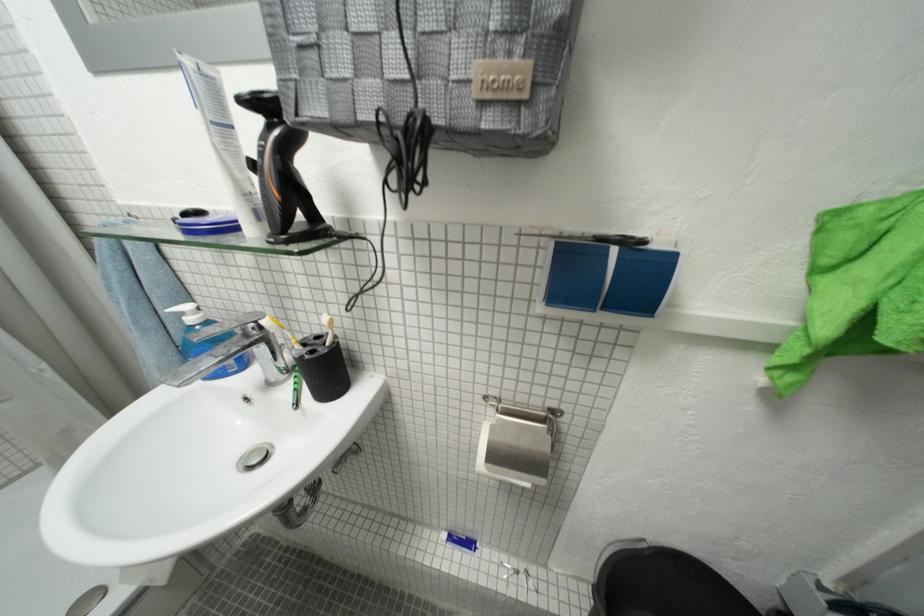
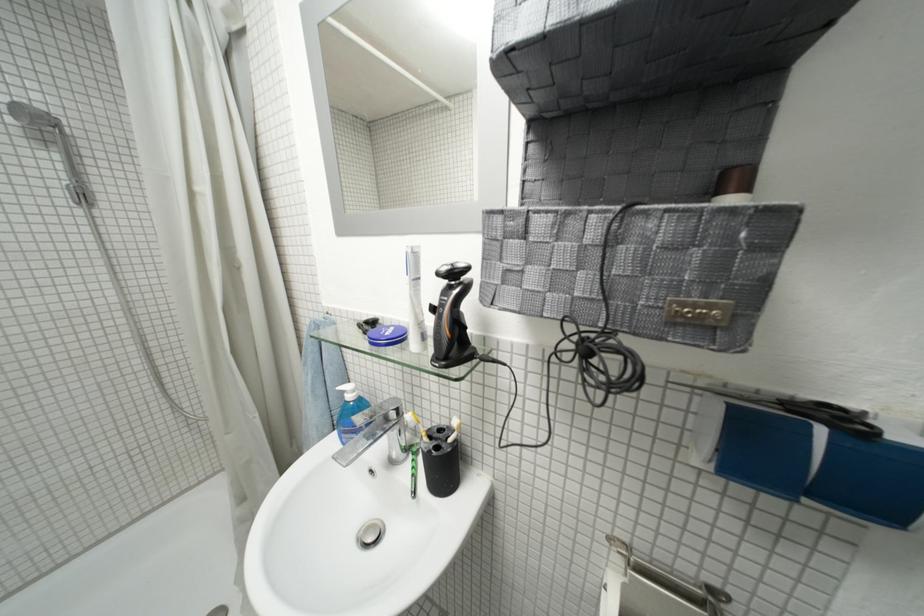
Question: Based on the continuous images, in which direction is the camera rotating? Reply with the corresponding letter.

Choices:
 (A) Left
 (B) Right
 (C) Up
 (D) Down

Answer: (A)